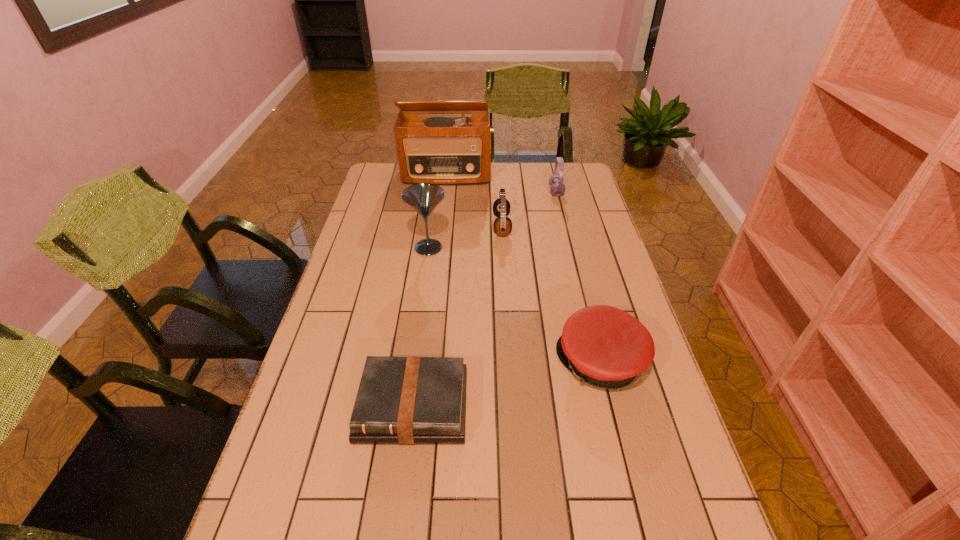
Locate an element on the screen. The height and width of the screenshot is (540, 960). the tallest object is located at coordinates (443, 150).

You are a GUI agent. You are given a task and a screenshot of the screen. Output one action in this format:
    pyautogui.click(x=<x>, y=<y>)
    Task: Click on the second tallest object
    The image size is (960, 540).
    Given the screenshot: What is the action you would take?
    pyautogui.click(x=424, y=197)

I want to click on the right headset, so click(557, 188).

You are a GUI agent. You are given a task and a screenshot of the screen. Output one action in this format:
    pyautogui.click(x=<x>, y=<y>)
    Task: Click on the nearer headset
    This screenshot has height=540, width=960.
    Given the screenshot: What is the action you would take?
    pyautogui.click(x=502, y=226)

Image resolution: width=960 pixels, height=540 pixels. In order to click on the fifth tallest object in this screenshot , I will do `click(606, 347)`.

Where is `the shortest object`? The width and height of the screenshot is (960, 540). the shortest object is located at coordinates (410, 400).

Where is `free space located 0.180m on the front panel of the radio receiver`? free space located 0.180m on the front panel of the radio receiver is located at coordinates (443, 211).

The height and width of the screenshot is (540, 960). I want to click on free region located on the left of the second tallest object, so click(x=362, y=248).

Identify the location of vacant space positioned 0.080m on the headband and ear cups of the right headset. (529, 192).

You are a GUI agent. You are given a task and a screenshot of the screen. Output one action in this format:
    pyautogui.click(x=<x>, y=<y>)
    Task: Click on the vacant area situated on the headband and ear cups of the right headset
    The height and width of the screenshot is (540, 960).
    Given the screenshot: What is the action you would take?
    pyautogui.click(x=529, y=192)